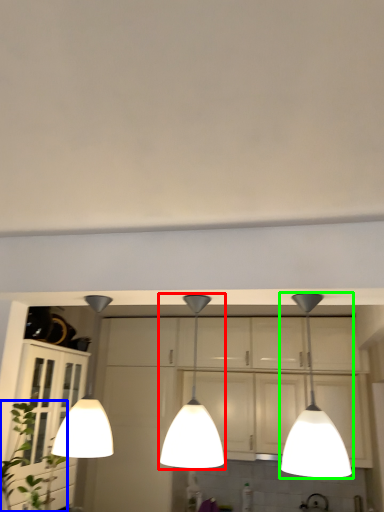
Question: Estimate the real-world distances between objects in this image. Which object is farther from lamp (highlighted by a red box), plant (highlighted by a blue box) or lamp (highlighted by a green box)?

Choices:
 (A) plant
 (B) lamp

Answer: (A)